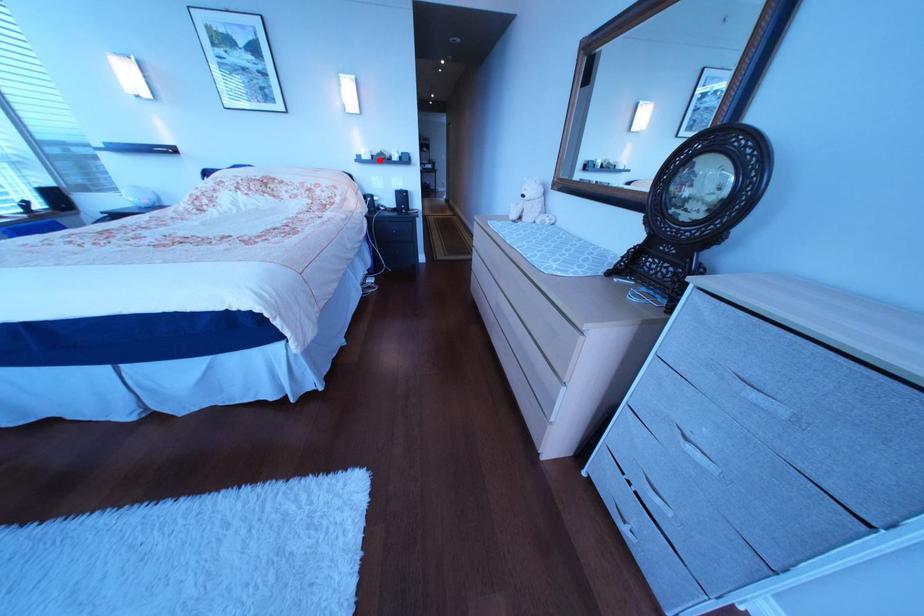
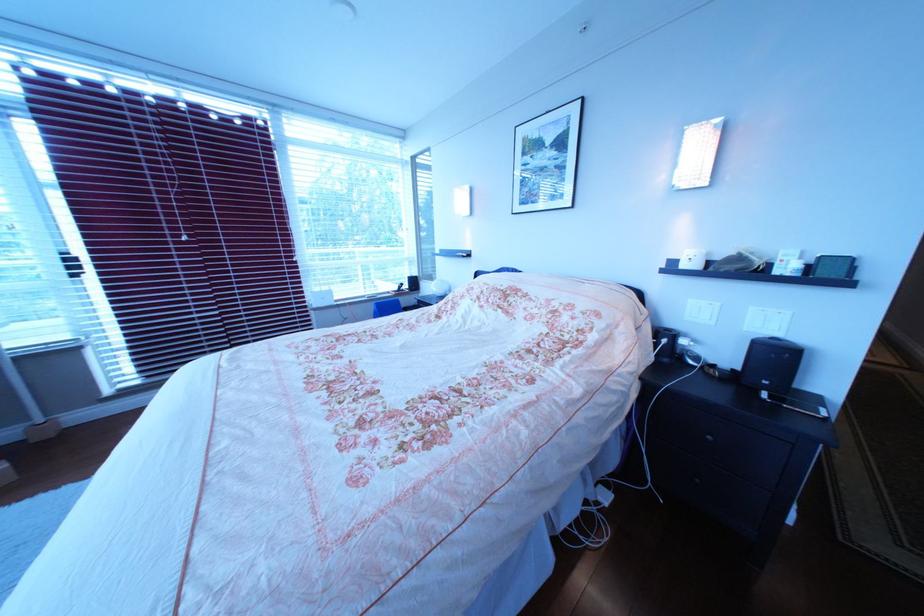
Question: I am providing you with two images of the same scene from different viewpoints. Given a red point in image1, look at the same physical point in image2. Is it:

Choices:
 (A) Closer to the viewpoint
 (B) Farther from the viewpoint

Answer: (B)